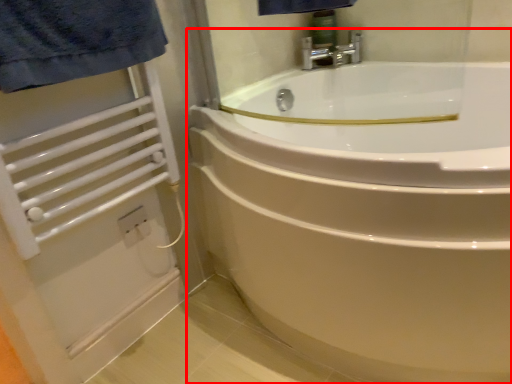
Question: From the image's perspective, where is bathtub (annotated by the red box) located relative to balustrade?

Choices:
 (A) below
 (B) above

Answer: (A)